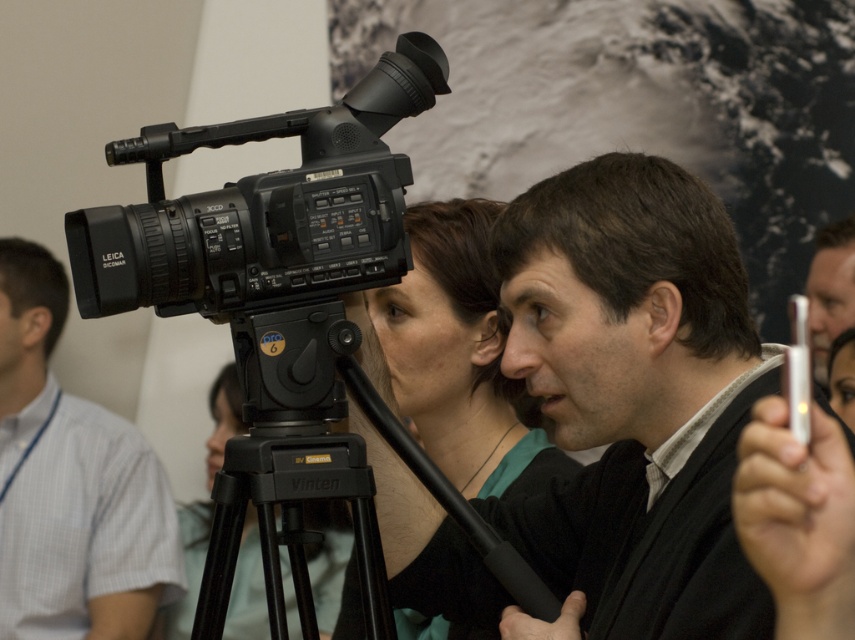
Question: Estimate the real-world distances between objects in this image. Which object is closer to the smooth black camera at center?

Choices:
 (A) black plastic tripod at center
 (B) black plastic camera at center
 (C) matte black camera at upper left

Answer: (C)

Question: Observing the image, what is the correct spatial positioning of matte black camera at upper left in reference to matte black tripod at center?

Choices:
 (A) right
 (B) left

Answer: (A)

Question: Which object appears closest to the camera in this image?

Choices:
 (A) black plastic camera at center
 (B) smooth black camera at center

Answer: (A)

Question: Does matte black camera at left come behind smooth black camera at center?

Choices:
 (A) no
 (B) yes

Answer: (B)

Question: Which of the following is the closest to the observer?

Choices:
 (A) (310, 561)
 (B) (161, 225)

Answer: (B)

Question: Does matte black camera at upper left have a larger size compared to black plastic camera at center?

Choices:
 (A) no
 (B) yes

Answer: (B)